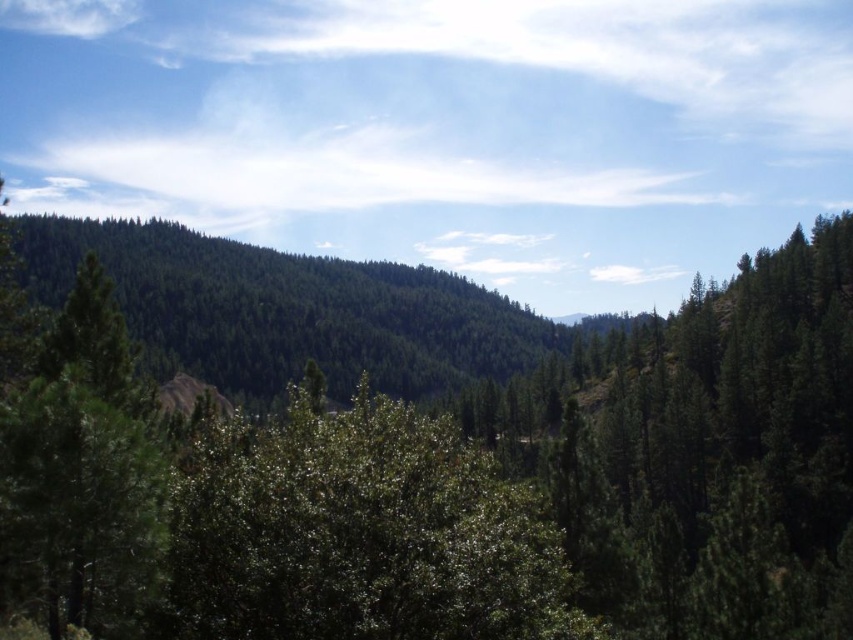
You are standing in the forest and see the green leafy forest at center and the green leafy tree at center. Which one is more to the left?

The green leafy forest at center is more to the left than the green leafy tree at center.